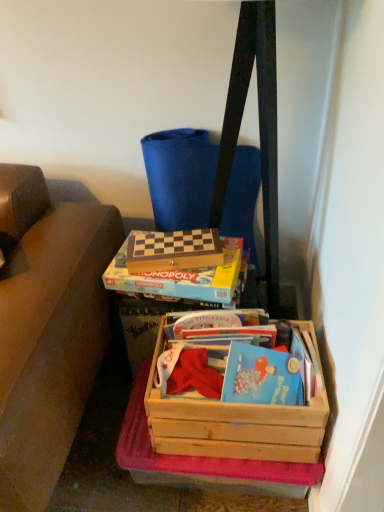
Question: Does wooden monopoly game at center, the 2th box positioned from the bottom, touch wooden chessboard at center, which is the first box from top to bottom?

Choices:
 (A) yes
 (B) no

Answer: (A)

Question: From a real-world perspective, does wooden monopoly game at center, which appears as the second box when viewed from the top, stand above wooden chessboard at center, which is the first box from top to bottom?

Choices:
 (A) yes
 (B) no

Answer: (B)

Question: From a real-world perspective, is wooden monopoly game at center, which appears as the second box when viewed from the top, physically below wooden chessboard at center, positioned as the 3th box in bottom-to-top order?

Choices:
 (A) yes
 (B) no

Answer: (A)

Question: From the image's perspective, is wooden monopoly game at center, which appears as the second box when viewed from the top, on top of wooden chessboard at center, which is the first box from top to bottom?

Choices:
 (A) no
 (B) yes

Answer: (A)

Question: Is wooden monopoly game at center, which appears as the second box when viewed from the top, behind wooden chessboard at center, positioned as the 3th box in bottom-to-top order?

Choices:
 (A) no
 (B) yes

Answer: (A)

Question: Is wooden monopoly game at center, the 2th box positioned from the bottom, not close to wooden chessboard at center, which is the first box from top to bottom?

Choices:
 (A) yes
 (B) no

Answer: (B)

Question: Considering the relative sizes of wooden crate at lower right, which is the third box from top to bottom, and wooden chessboard at center, which is the first box from top to bottom, in the image provided, is wooden crate at lower right, which is the third box from top to bottom, smaller than wooden chessboard at center, which is the first box from top to bottom,?

Choices:
 (A) yes
 (B) no

Answer: (B)

Question: Is wooden crate at lower right, positioned as the first box in bottom-to-top order, aimed at wooden chessboard at center, which is the first box from top to bottom?

Choices:
 (A) yes
 (B) no

Answer: (B)

Question: Would you say wooden crate at lower right, which is the third box from top to bottom, is outside wooden chessboard at center, which is the first box from top to bottom?

Choices:
 (A) no
 (B) yes

Answer: (B)

Question: Considering the relative sizes of wooden crate at lower right, positioned as the first box in bottom-to-top order, and wooden chessboard at center, positioned as the 3th box in bottom-to-top order, in the image provided, is wooden crate at lower right, positioned as the first box in bottom-to-top order, taller than wooden chessboard at center, positioned as the 3th box in bottom-to-top order,?

Choices:
 (A) no
 (B) yes

Answer: (B)

Question: Does wooden crate at lower right, which is the third box from top to bottom, have a lesser width compared to wooden chessboard at center, which is the first box from top to bottom?

Choices:
 (A) yes
 (B) no

Answer: (B)

Question: Is wooden crate at lower right, positioned as the first box in bottom-to-top order, far away from wooden chessboard at center, which is the first box from top to bottom?

Choices:
 (A) no
 (B) yes

Answer: (A)

Question: Is wooden chessboard at center, positioned as the 3th box in bottom-to-top order, positioned before wooden crate at lower right, which is the third box from top to bottom?

Choices:
 (A) yes
 (B) no

Answer: (B)